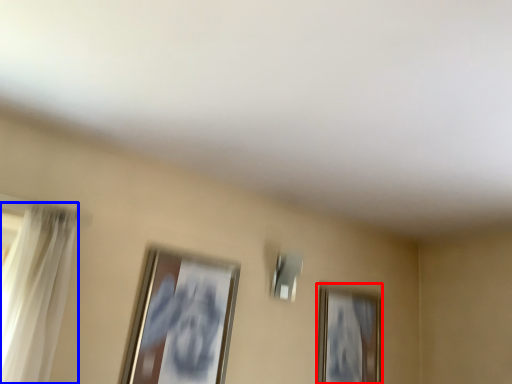
Question: Which object appears farthest to the camera in this image, picture frame (highlighted by a red box) or curtain (highlighted by a blue box)?

Choices:
 (A) picture frame
 (B) curtain

Answer: (A)